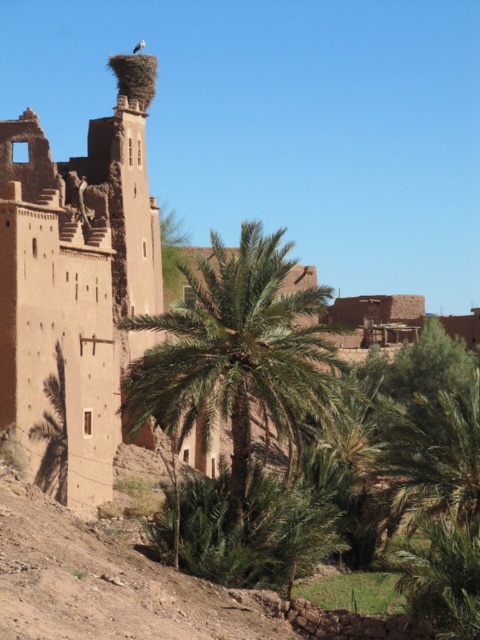
This screenshot has width=480, height=640. What do you see at coordinates (76, 276) in the screenshot? I see `brown mudbrick ruins at upper center` at bounding box center [76, 276].

Does brown mudbrick ruins at upper center have a greater width compared to green leafy palm at center?

No, brown mudbrick ruins at upper center is not wider than green leafy palm at center.

Where is `brown mudbrick ruins at upper center`? The width and height of the screenshot is (480, 640). brown mudbrick ruins at upper center is located at coordinates (76, 276).

Does green leafy palm at center have a smaller size compared to brown nest at upper center?

Indeed, green leafy palm at center has a smaller size compared to brown nest at upper center.

Based on the photo, is green leafy palm at center taller than brown nest at upper center?

No.

The image size is (480, 640). What are the coordinates of `green leafy palm at center` in the screenshot? It's located at (235, 353).

Locate an element on the screen. The width and height of the screenshot is (480, 640). green leafy palm at center is located at coordinates (235, 353).

This screenshot has width=480, height=640. I want to click on brown mudbrick ruins at upper center, so click(76, 276).

Is point (131, 220) less distant than point (137, 51)?

Yes, it is.

Where is `brown mudbrick ruins at upper center`? brown mudbrick ruins at upper center is located at coordinates (76, 276).